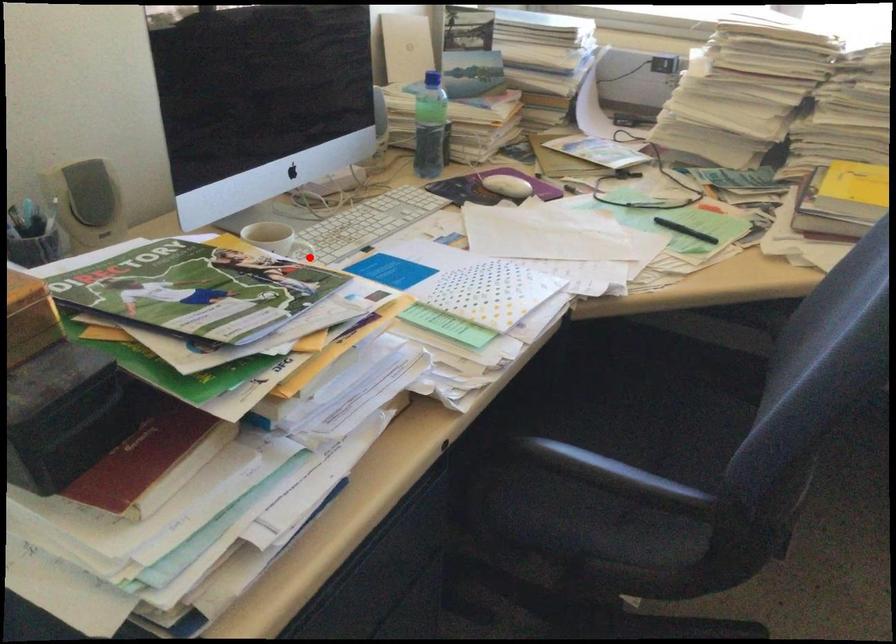
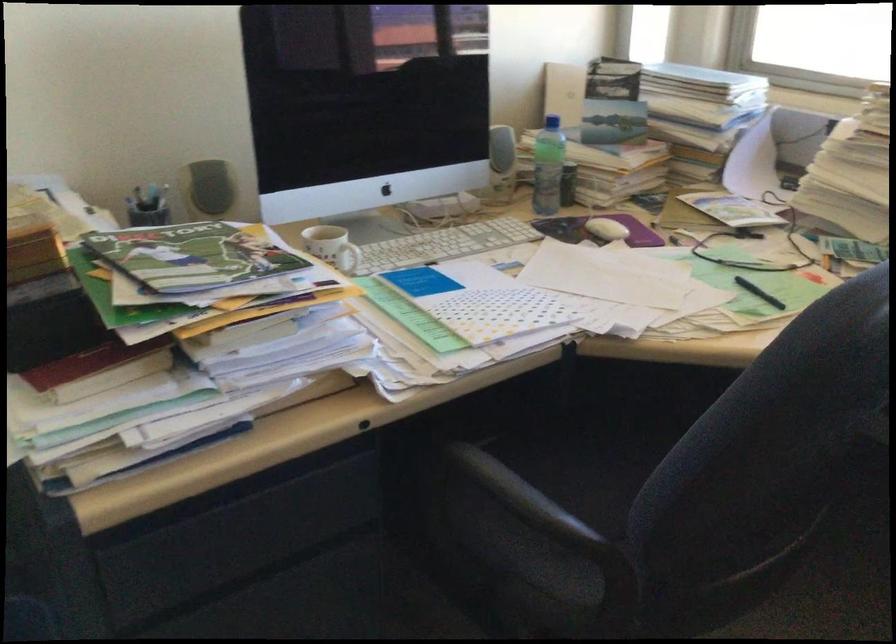
Question: A red point is marked in image1. In image2, is the corresponding 3D point closer to the camera or farther? Reply with the corresponding letter.

Choices:
 (A) The corresponding 3D point is closer.
 (B) The corresponding 3D point is farther.

Answer: (B)